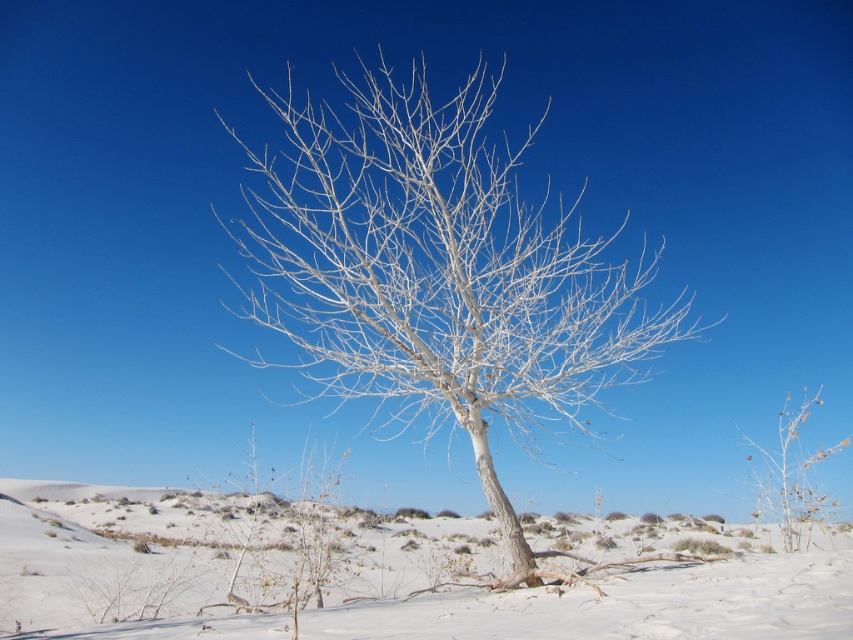
You are an artist sketching the landscape. You need to decide which object to draw first based on their sizes. Which one should you start with, the white matte tree at center or the white powdery snow at center?

The white matte tree at center is smaller than the white powdery snow at center, so you should start with the white matte tree at center first since smaller details are often sketched before larger areas.

You are an artist trying to sketch the scene. You notice the white matte tree at center and the white powdery snow at center. Which object is located to the right of the other?

The white matte tree at center is positioned on the right side of white powdery snow at center.

In the scene shown: You are standing in the snow and see the white matte tree at center. If you walk directly towards the point at coordinates (x=438, y=272), will you be walking towards the tree?

Yes, because the point at coordinates (x=438, y=272) corresponds to the white matte tree at center, so walking towards that point would lead you directly to the tree.